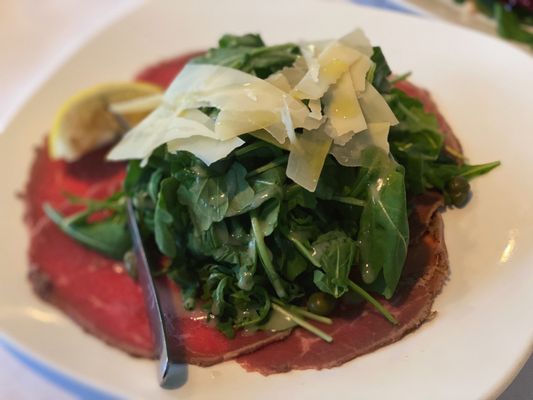
The height and width of the screenshot is (400, 533). Identify the location of whie plate. (487, 111), (487, 362), (77, 343), (47, 103), (169, 31).